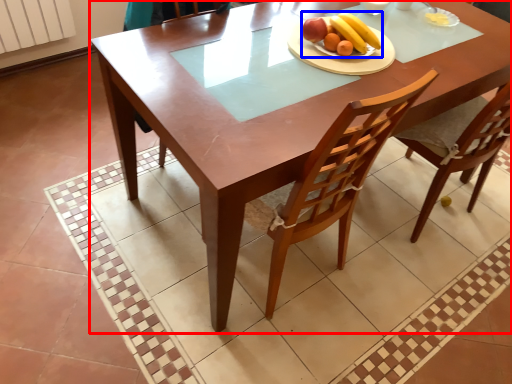
Question: Which object appears farthest to the camera in this image, table (highlighted by a red box) or fruit salad (highlighted by a blue box)?

Choices:
 (A) table
 (B) fruit salad

Answer: (B)